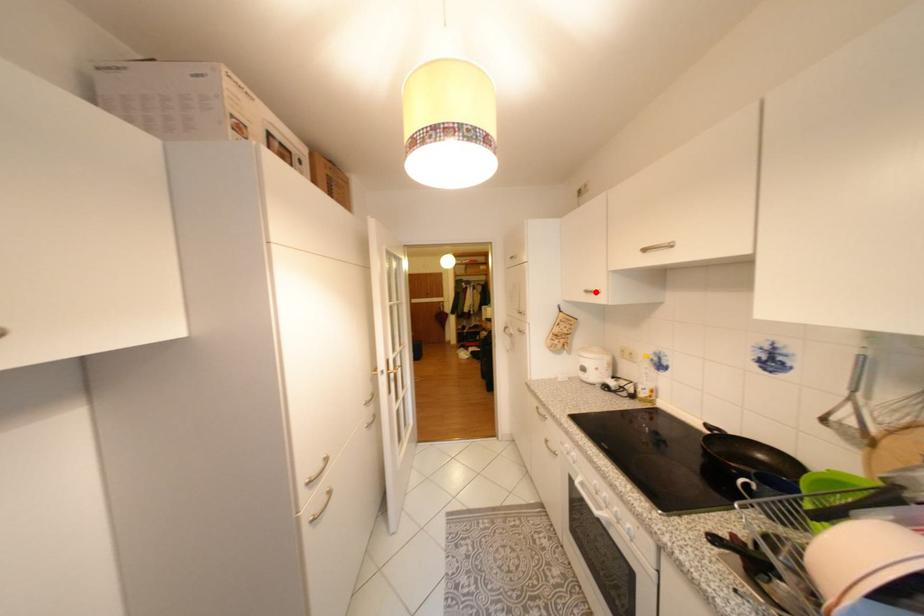
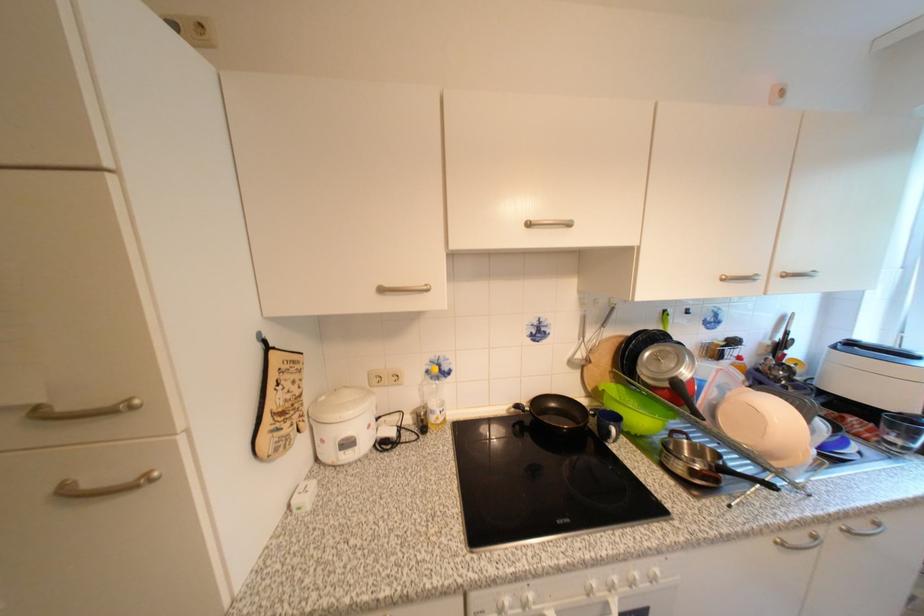
Find the pixel in the second image that matches the highlighted location in the first image.

(391, 291)